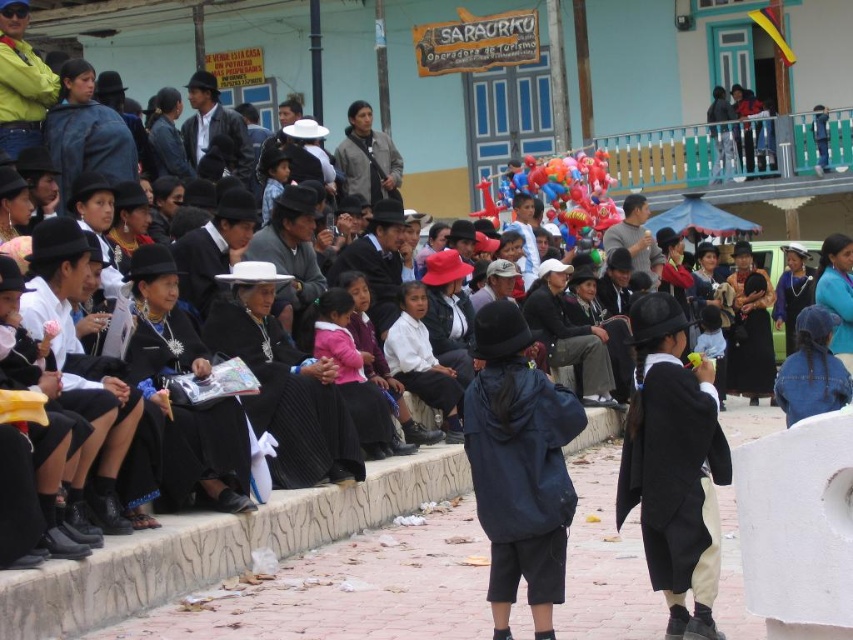
Question: Is matte black coat at center to the right of multicolored glossy balloons at center from the viewer's perspective?

Choices:
 (A) yes
 (B) no

Answer: (A)

Question: Estimate the real-world distances between objects in this image. Which object is closer to the matte black coat at center?

Choices:
 (A) multicolored glossy balloons at center
 (B) navy blue fabric jacket at center

Answer: (B)

Question: Is navy blue fabric jacket at center smaller than matte black coat at center?

Choices:
 (A) no
 (B) yes

Answer: (B)

Question: Which of the following is the farthest from the observer?

Choices:
 (A) multicolored glossy balloons at center
 (B) matte black coat at center

Answer: (A)

Question: Considering the real-world distances, which object is closest to the multicolored glossy balloons at center?

Choices:
 (A) navy blue fabric jacket at center
 (B) matte black coat at center

Answer: (B)

Question: Does navy blue fabric jacket at center have a greater width compared to multicolored glossy balloons at center?

Choices:
 (A) yes
 (B) no

Answer: (B)